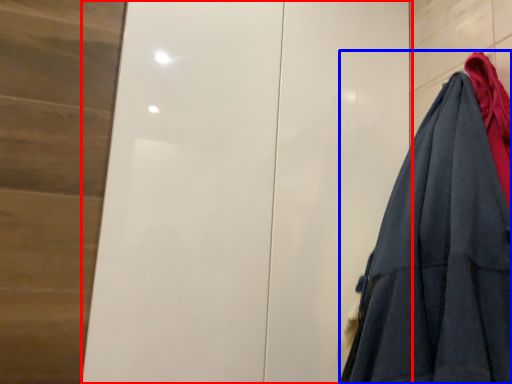
Question: Which object appears closest to the camera in this image, door (highlighted by a red box) or garment (highlighted by a blue box)?

Choices:
 (A) door
 (B) garment

Answer: (B)